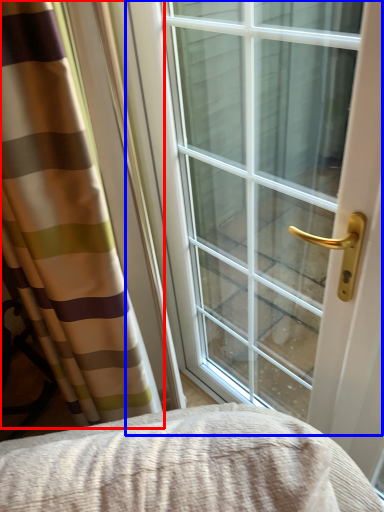
Question: Which object is further to the camera taking this photo, curtain (highlighted by a red box) or window (highlighted by a blue box)?

Choices:
 (A) curtain
 (B) window

Answer: (B)